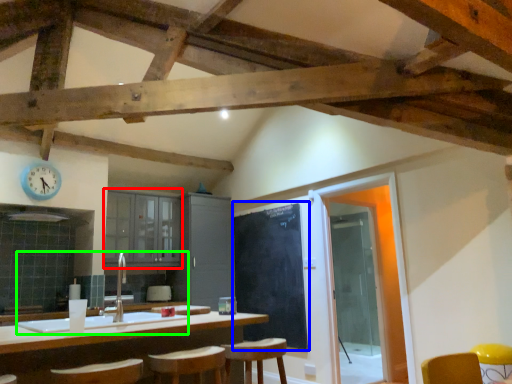
Question: Which object is positioned farthest from cabinetry (highlighted by a red box)? Select from bulletin board (highlighted by a blue box) and sink (highlighted by a green box).

Choices:
 (A) bulletin board
 (B) sink

Answer: (B)